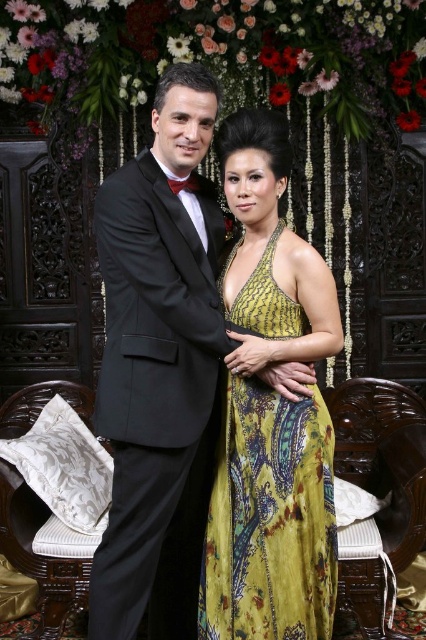
You are a photographer adjusting your camera settings to focus on the yellow printed fabric dress at center. Since the black satin tuxedo at left is in the frame, will it be in focus as well?

The black satin tuxedo at left is closer to the viewer than the yellow printed fabric dress at center. Since the dress is your focus point, the tuxedo may appear slightly out of focus depending on the depth of field. Adjust your aperture for a wider depth of field if you want both in focus.

You are a photographer setting up for a photoshoot. You have a backdrop that can only accommodate outfits with a width of up to 1.2 meters. Given that the black satin tuxedo at left and the yellow printed fabric dress at center are part of the outfit, can both fit within the backdrop width? Please explain your reasoning.

The black satin tuxedo at left has a larger width than the yellow printed fabric dress at center. Since the tuxedo is wider, and the backdrop can only accommodate up to 1.2 meters, if the tuxedo exceeds this width, it would not fit. However, if the tuxedo is within 1.2 meters, both could potentially fit. But since we only know the relative sizes, not absolute measurements, we cannot definitively answer without knowing the exact width of the tuxedo.

You are a photographer at a formal event. You need to determine which of the two men in black attire is closer to the camera based on their clothing details. The men are wearing a black satin tuxedo at left and a shiny black suit at left. Which one is closer?

The black satin tuxedo at left is thinner than the shiny black suit at left, so the black satin tuxedo at left is closer to the camera.